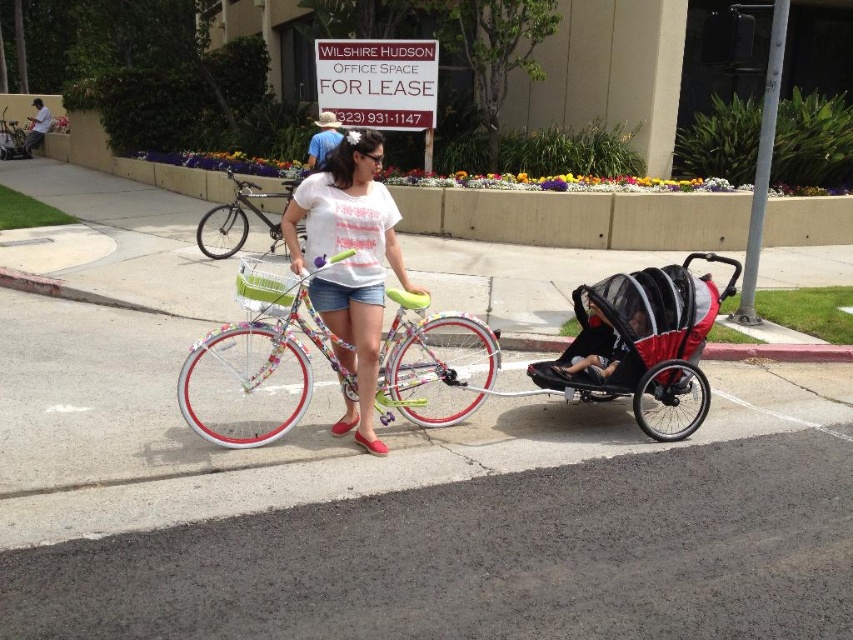
Question: Which object is farther from the camera taking this photo?

Choices:
 (A) black mesh baby carriage at center
 (B) metallic silver bicycle at left
 (C) metallic silver bicycle at center

Answer: (B)

Question: Which object appears closest to the camera in this image?

Choices:
 (A) soft gray fabric stroller at center
 (B) floral fabric shirt at center
 (C) metallic silver bicycle at left

Answer: (B)

Question: Is black mesh baby carriage at center to the right of metallic silver bicycle at left from the viewer's perspective?

Choices:
 (A) yes
 (B) no

Answer: (A)

Question: Which is nearer to the soft gray fabric stroller at center?

Choices:
 (A) black mesh baby carriage at center
 (B) metallic silver bicycle at left
 (C) floral fabric shirt at center
 (D) floral painted bicycle at center

Answer: (A)

Question: Is soft gray fabric stroller at center positioned behind metallic silver bicycle at left?

Choices:
 (A) no
 (B) yes

Answer: (A)

Question: Considering the relative positions of metallic silver bicycle at center and soft gray fabric stroller at center in the image provided, where is metallic silver bicycle at center located with respect to soft gray fabric stroller at center?

Choices:
 (A) left
 (B) right

Answer: (A)